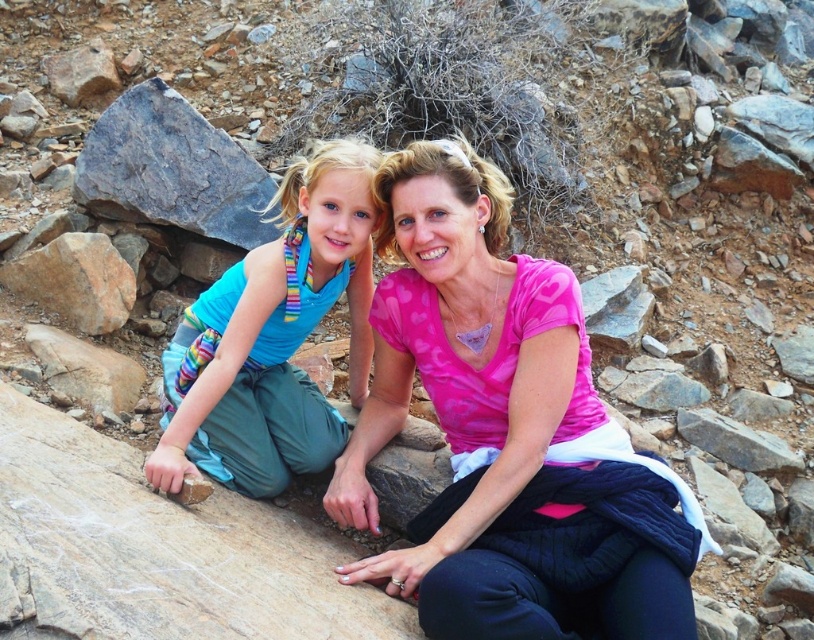
You are a photographer trying to capture both the pink fabric at center and the gray rough boulder at upper left in a single frame. Based on their sizes, which object should you focus on to ensure both fit in the shot?

The pink fabric at center is bigger than the gray rough boulder at upper left. To ensure both fit in the shot, focus on the pink fabric at center since it occupies more space, allowing the smaller gray rough boulder at upper left to be included as well.

You are standing in front of the two fabrics in the center of the image. The pink fabric at center is to the right of the blue fabric at center. Which fabric is positioned closer to your right side?

The pink fabric at center is positioned to the right of the blue fabric at center, so the pink fabric at center is closer to your right side.